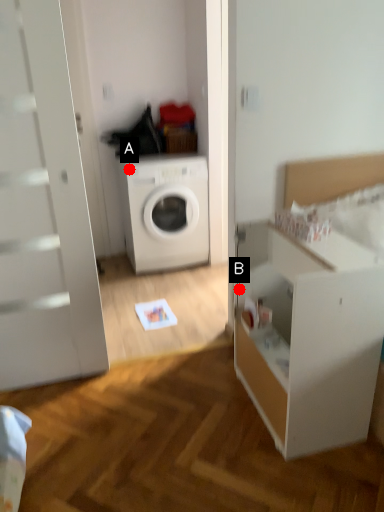
Question: Two points are circled on the image, labeled by A and B beside each circle. Which point is closer to the camera?

Choices:
 (A) A is closer
 (B) B is closer

Answer: (B)